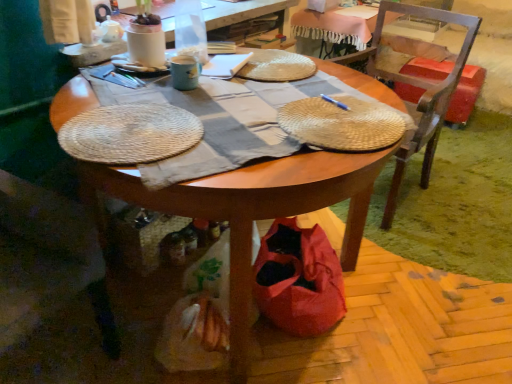
Question: Is translucent plastic bottle at upper center positioned in front of matte ceramic mug at upper center?

Choices:
 (A) no
 (B) yes

Answer: (A)

Question: From a real-world perspective, is translucent plastic bottle at upper center on top of matte ceramic mug at upper center?

Choices:
 (A) no
 (B) yes

Answer: (B)

Question: Is matte ceramic mug at upper center at the back of translucent plastic bottle at upper center?

Choices:
 (A) no
 (B) yes

Answer: (A)

Question: Can you confirm if translucent plastic bottle at upper center is thinner than matte ceramic mug at upper center?

Choices:
 (A) yes
 (B) no

Answer: (B)

Question: Can you confirm if translucent plastic bottle at upper center is positioned to the right of matte ceramic mug at upper center?

Choices:
 (A) yes
 (B) no

Answer: (A)

Question: Is wooden table at center bigger or smaller than red plastic trash can at right?

Choices:
 (A) big
 (B) small

Answer: (A)

Question: Would you say wooden table at center is to the left or to the right of red plastic trash can at right in the picture?

Choices:
 (A) right
 (B) left

Answer: (B)

Question: From a real-world perspective, is wooden table at center physically located above or below red plastic trash can at right?

Choices:
 (A) below
 (B) above

Answer: (B)

Question: From the image's perspective, relative to red plastic trash can at right, is wooden table at center above or below?

Choices:
 (A) above
 (B) below

Answer: (B)

Question: From a real-world perspective, is blue metallic pen at center physically located above or below red plastic trash can at right?

Choices:
 (A) above
 (B) below

Answer: (A)

Question: In terms of height, does blue metallic pen at center look taller or shorter compared to red plastic trash can at right?

Choices:
 (A) short
 (B) tall

Answer: (A)

Question: Visually, is blue metallic pen at center positioned to the left or to the right of red plastic trash can at right?

Choices:
 (A) right
 (B) left

Answer: (B)

Question: Which is correct: blue metallic pen at center is inside red plastic trash can at right, or outside of it?

Choices:
 (A) inside
 (B) outside

Answer: (B)

Question: Considering the positions of woven straw placemat at center and wooden table at center in the image, is woven straw placemat at center wider or thinner than wooden table at center?

Choices:
 (A) thin
 (B) wide

Answer: (A)

Question: From the image's perspective, relative to wooden table at center, is woven straw placemat at center above or below?

Choices:
 (A) below
 (B) above

Answer: (B)